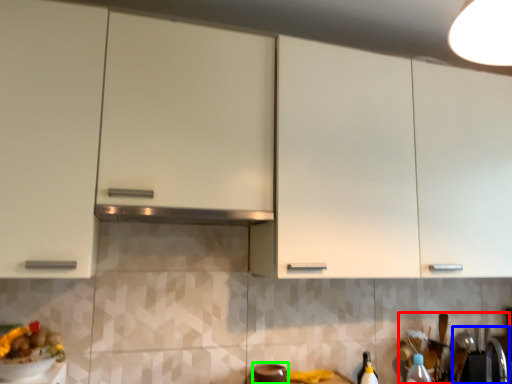
Question: Based on their relative distances, which object is nearer to sink (highlighted by a red box)? Choose from sink (highlighted by a blue box) and appliance (highlighted by a green box).

Choices:
 (A) sink
 (B) appliance

Answer: (A)